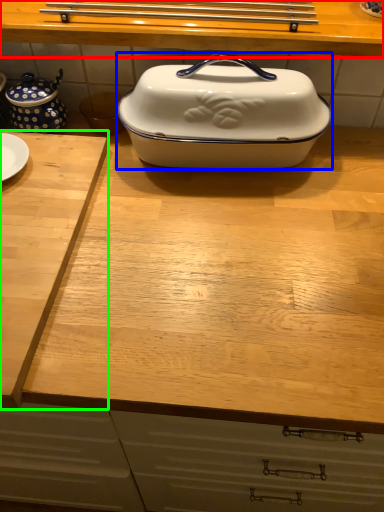
Question: Based on their relative distances, which object is farther from countertop (highlighted by a red box)? Choose from kitchen appliance (highlighted by a blue box) and cutting board (highlighted by a green box).

Choices:
 (A) kitchen appliance
 (B) cutting board

Answer: (B)